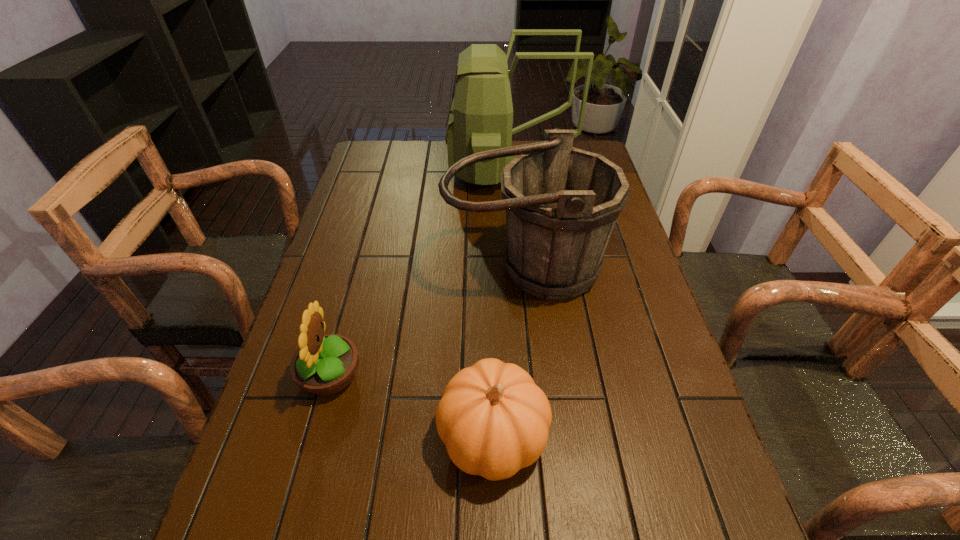
The image size is (960, 540). I want to click on object that is the third closest one to the bucket, so click(x=494, y=420).

Locate an element on the screen. free spot that satisfies the following two spatial constraints: 1. on the face of the sunflower; 2. on the left side of the pumpkin is located at coordinates tap(314, 436).

This screenshot has width=960, height=540. Find the location of `free space that satisfies the following two spatial constraints: 1. on the handle side of the second tallest object; 2. on the face of the sunflower`. free space that satisfies the following two spatial constraints: 1. on the handle side of the second tallest object; 2. on the face of the sunflower is located at coordinates (536, 376).

Locate an element on the screen. This screenshot has width=960, height=540. vacant space that satisfies the following two spatial constraints: 1. on the face of the pumpkin; 2. on the right side of the leftmost object is located at coordinates (314, 436).